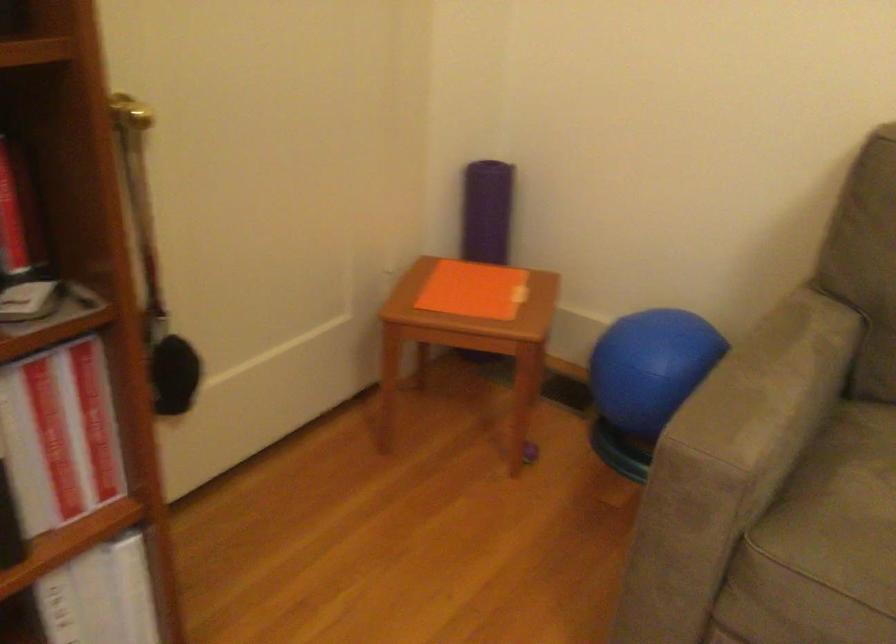
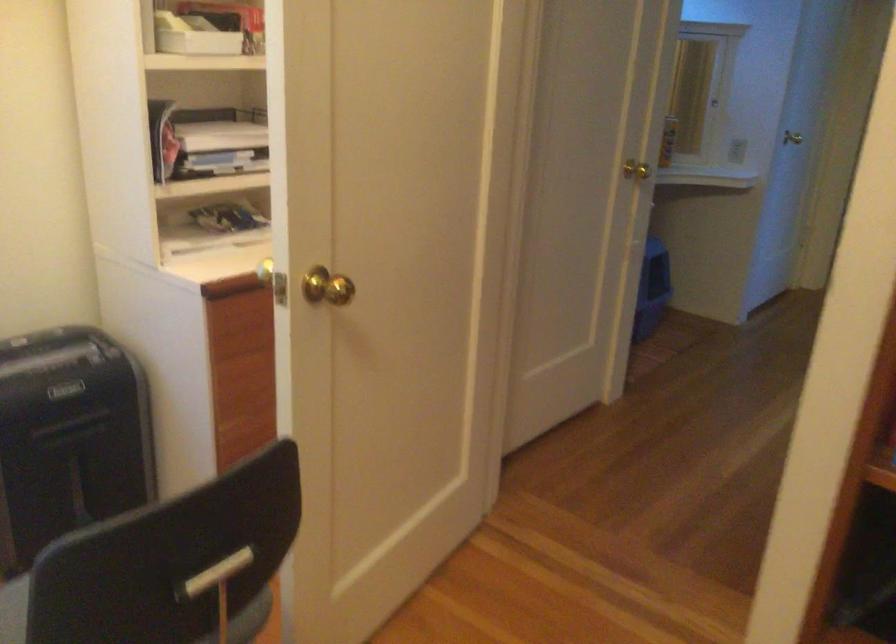
In the scene shown: The first image is from the beginning of the video and the second image is from the end. How did the camera likely rotate when shooting the video?

The rotation direction of the camera is left-down.